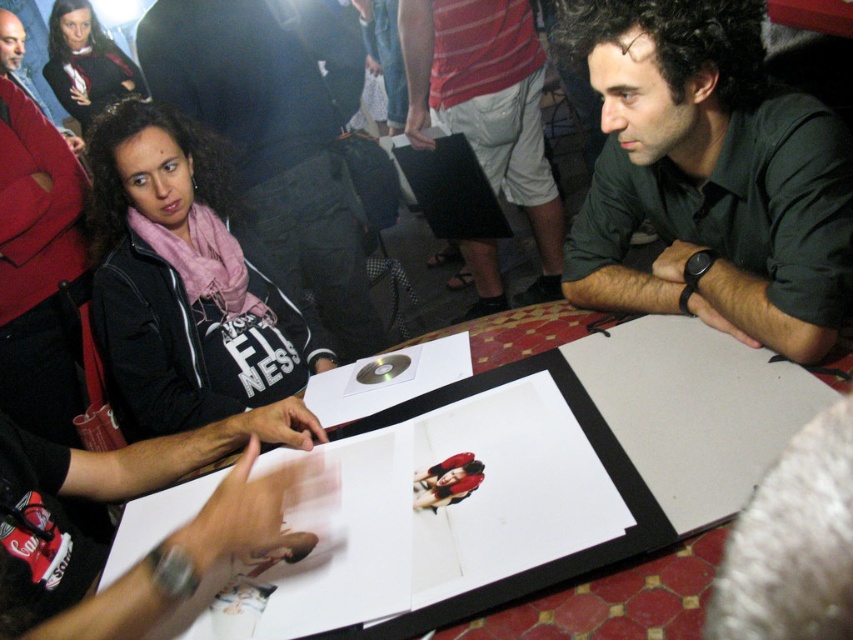
Question: Can you confirm if dark green shirt at right is bigger than pink scarf at left?

Choices:
 (A) no
 (B) yes

Answer: (A)

Question: Which point is farther to the camera?

Choices:
 (A) (558, 273)
 (B) (352, 282)

Answer: (A)

Question: Which object appears closest to the camera in this image?

Choices:
 (A) matte black scarf at upper left
 (B) matte black jacket at upper left

Answer: (B)

Question: Can you confirm if dark green shirt at right is bigger than white cotton shorts at center?

Choices:
 (A) no
 (B) yes

Answer: (A)

Question: Among these points, which one is nearest to the camera?

Choices:
 (A) (209, 90)
 (B) (641, 218)
 (C) (431, 10)
 (D) (645, 406)

Answer: (D)

Question: Can you confirm if smooth wooden table at center is positioned above pink scarf at left?

Choices:
 (A) yes
 (B) no

Answer: (B)